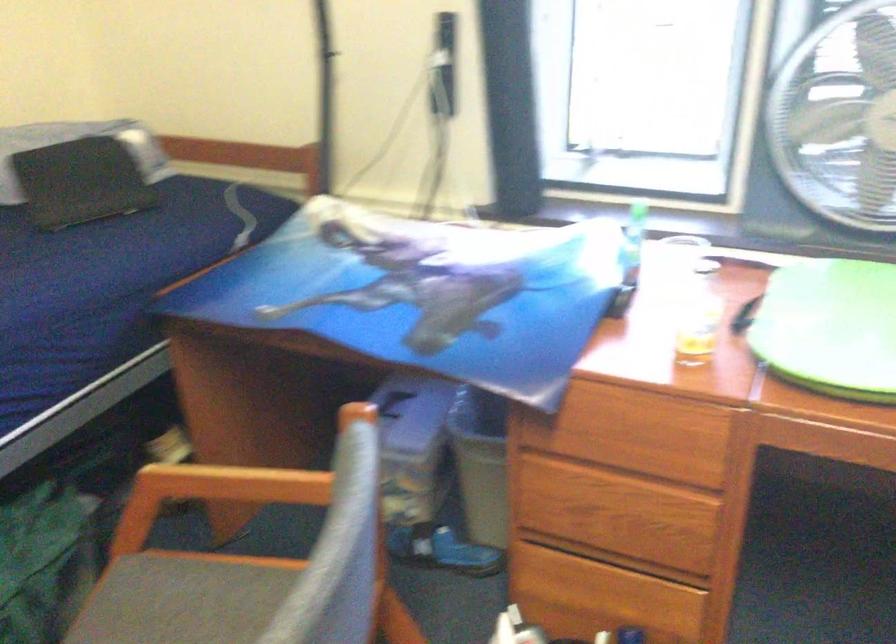
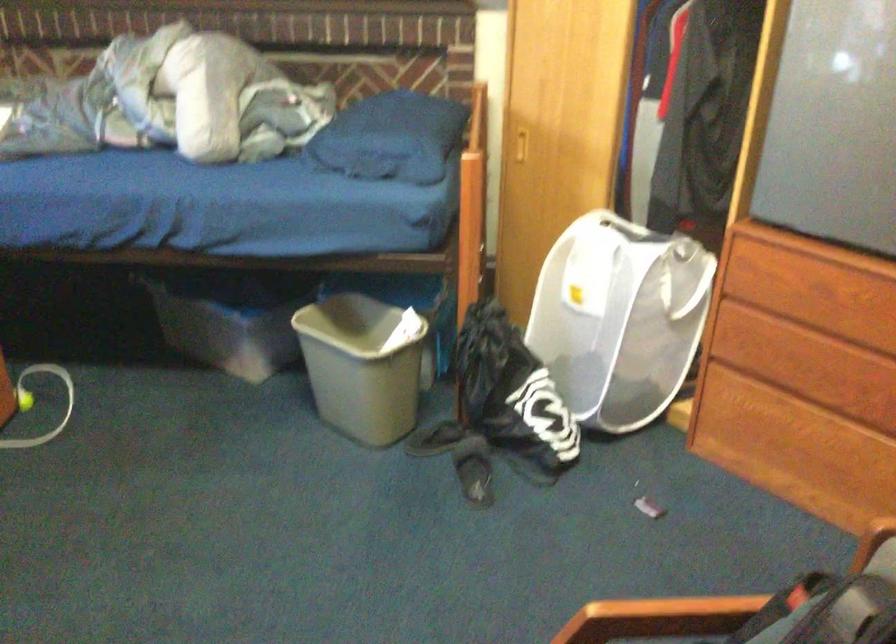
Based on the continuous images, in which direction is the camera rotating?

The camera rotated toward right-down.